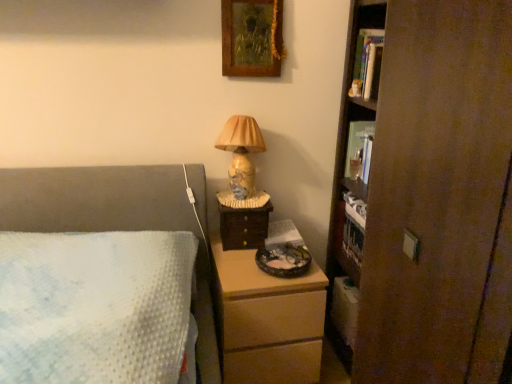
Describe the element at coordinates (359, 150) in the screenshot. I see `hardcover book at upper right, which ranks as the first book in back-to-front order` at that location.

Identify the location of hardcover book at upper right, which is the 2th book from front to back. The height and width of the screenshot is (384, 512). (359, 150).

The width and height of the screenshot is (512, 384). Describe the element at coordinates (267, 320) in the screenshot. I see `wooden chest of drawers at lower center` at that location.

You are a GUI agent. You are given a task and a screenshot of the screen. Output one action in this format:
    pyautogui.click(x=<x>, y=<y>)
    Task: Click on the hardcover book at upper right, which is the 2th book in top-to-bottom order
    Image resolution: width=512 pixels, height=384 pixels.
    Given the screenshot: What is the action you would take?
    pyautogui.click(x=359, y=150)

Is wooden picture frame at upper center inside brown wooden bookcase at right?

No, wooden picture frame at upper center is located outside of brown wooden bookcase at right.

Is brown wooden bookcase at right aimed at wooden picture frame at upper center?

No, brown wooden bookcase at right is not oriented towards wooden picture frame at upper center.

Is point (391, 33) behind point (222, 66)?

No, (391, 33) is in front of (222, 66).

How many degrees apart are the facing directions of brown wooden bookcase at right and wooden picture frame at upper center?

brown wooden bookcase at right and wooden picture frame at upper center are facing 89.7 degrees away from each other.

Is wooden picture frame at upper center at the back of white plush cat at upper right?

No, white plush cat at upper right is not facing the opposite direction of wooden picture frame at upper center.

In the scene shown: Which object is further away from the camera taking this photo, white plush cat at upper right or wooden picture frame at upper center?

white plush cat at upper right.

Looking at this image, looking at the image, does matte ceramic lamp at center seem bigger or smaller compared to wooden chest of drawers at lower center?

matte ceramic lamp at center is smaller than wooden chest of drawers at lower center.

Is matte ceramic lamp at center positioned with its back to wooden chest of drawers at lower center?

No, matte ceramic lamp at center is not facing away from wooden chest of drawers at lower center.

Are matte ceramic lamp at center and wooden chest of drawers at lower center far apart?

No, matte ceramic lamp at center is in close proximity to wooden chest of drawers at lower center.

Identify the location of chest of drawers below the matte ceramic lamp at center (from a real-world perspective). (267, 320).

Is hardcover book at upper right, the second book ordered from the bottom, positioned with its back to wooden chest of drawers at lower center?

No, hardcover book at upper right, the second book ordered from the bottom, is not facing away from wooden chest of drawers at lower center.

Is hardcover book at upper right, which is counted as the 2th book, starting from the back, wider than wooden chest of drawers at lower center?

In fact, hardcover book at upper right, which is counted as the 2th book, starting from the back, might be narrower than wooden chest of drawers at lower center.

Is hardcover book at upper right, which is counted as the 2th book, starting from the back, spatially inside wooden chest of drawers at lower center, or outside of it?

hardcover book at upper right, which is counted as the 2th book, starting from the back, lies outside wooden chest of drawers at lower center.

Is hardcover book at upper right, the second book ordered from the bottom, in contact with wooden chest of drawers at lower center?

No.

Which of these two, wooden chest of drawers at lower center or brown wooden bookcase at right, is bigger?

Bigger between the two is wooden chest of drawers at lower center.

From the picture: Would you say wooden chest of drawers at lower center contains brown wooden bookcase at right?

No, brown wooden bookcase at right is not surrounded by wooden chest of drawers at lower center.

From a real-world perspective, is wooden chest of drawers at lower center beneath brown wooden bookcase at right?

Yes.

Which object is positioned more to the left, wooden chest of drawers at lower center or brown wooden bookcase at right?

From the viewer's perspective, wooden chest of drawers at lower center appears more on the left side.

Is wooden picture frame at upper center directly adjacent to wooden drawer at right?

No, wooden picture frame at upper center is not with wooden drawer at right.

Is wooden picture frame at upper center positioned with its back to wooden drawer at right?

No, wooden picture frame at upper center's orientation is not away from wooden drawer at right.

Considering the relative sizes of wooden picture frame at upper center and wooden drawer at right in the image provided, is wooden picture frame at upper center thinner than wooden drawer at right?

Yes.

Does hardcover book at upper right, which ranks as the 1th book in bottom-to-top order, touch matte ceramic lamp at center?

No, hardcover book at upper right, which ranks as the 1th book in bottom-to-top order, is not making contact with matte ceramic lamp at center.

Who is taller, hardcover book at upper right, which ranks as the first book in back-to-front order, or matte ceramic lamp at center?

Standing taller between the two is matte ceramic lamp at center.

How many degrees apart are the facing directions of hardcover book at upper right, which ranks as the first book in back-to-front order, and matte ceramic lamp at center?

They differ by 89.8 degrees in their facing directions.

From the image's perspective, is hardcover book at upper right, which is the 2th book in top-to-bottom order, on matte ceramic lamp at center?

Yes, from the image's perspective, hardcover book at upper right, which is the 2th book in top-to-bottom order, is over matte ceramic lamp at center.

Locate an element on the screen. bookcase below the wooden picture frame at upper center (from the image's perspective) is located at coordinates (428, 198).

At what (x,y) coordinates should I click in order to perform the action: click on picture frame in front of the white plush cat at upper right. Please return your answer as a coordinate pair (x, y). This screenshot has height=384, width=512. Looking at the image, I should click on (252, 38).

Considering their positions, is wooden picture frame at upper center positioned further to hardcover book at upper right, the 1th book in the front-to-back sequence, than hardcover book at upper right, which is the 2th book in top-to-bottom order?

wooden picture frame at upper center.

Looking at the image, which one is located closer to wooden drawer at right, hardcover book at upper right, which ranks as the 1th book in bottom-to-top order, or hardcover book at upper right, the 1th book in the front-to-back sequence?

The object closer to wooden drawer at right is hardcover book at upper right, which ranks as the 1th book in bottom-to-top order.

Based on their spatial positions, is hardcover book at upper right, which is the 2th book in top-to-bottom order, or matte ceramic lamp at center further from wooden drawer at right?

The object further to wooden drawer at right is hardcover book at upper right, which is the 2th book in top-to-bottom order.

When comparing their distances from white plush cat at upper right, does wooden picture frame at upper center or brown wooden bookcase at right seem further?

brown wooden bookcase at right is further to white plush cat at upper right.

From the image, which object appears to be nearer to wooden picture frame at upper center, white plush cat at upper right or brown wooden bookcase at right?

white plush cat at upper right lies closer to wooden picture frame at upper center than the other object.

Considering their positions, is hardcover book at upper right, the 1th book in the front-to-back sequence, positioned closer to wooden chest of drawers at lower center than wooden picture frame at upper center?

The object closer to wooden chest of drawers at lower center is wooden picture frame at upper center.

From the image, which object appears to be farther from brown wooden bookcase at right, matte ceramic lamp at center or wooden chest of drawers at lower center?

matte ceramic lamp at center lies further to brown wooden bookcase at right than the other object.

When comparing their distances from brown wooden bookcase at right, does matte ceramic lamp at center or hardcover book at upper right, the 1th book in the front-to-back sequence, seem closer?

The object closer to brown wooden bookcase at right is matte ceramic lamp at center.

Where is `picture frame between matte ceramic lamp at center and white plush cat at upper right`? Image resolution: width=512 pixels, height=384 pixels. picture frame between matte ceramic lamp at center and white plush cat at upper right is located at coordinates (252, 38).

The width and height of the screenshot is (512, 384). What are the coordinates of `nightstand between matte ceramic lamp at center and hardcover book at upper right, which is the 2th book in top-to-bottom order, in the horizontal direction` in the screenshot? It's located at (243, 226).

The image size is (512, 384). What are the coordinates of `picture frame between brown wooden bookcase at right and white plush cat at upper right in the front-back direction` in the screenshot? It's located at (252, 38).

I want to click on toy between matte ceramic lamp at center and hardcover book at upper right, the 1th book in the front-to-back sequence, from left to right, so click(355, 88).